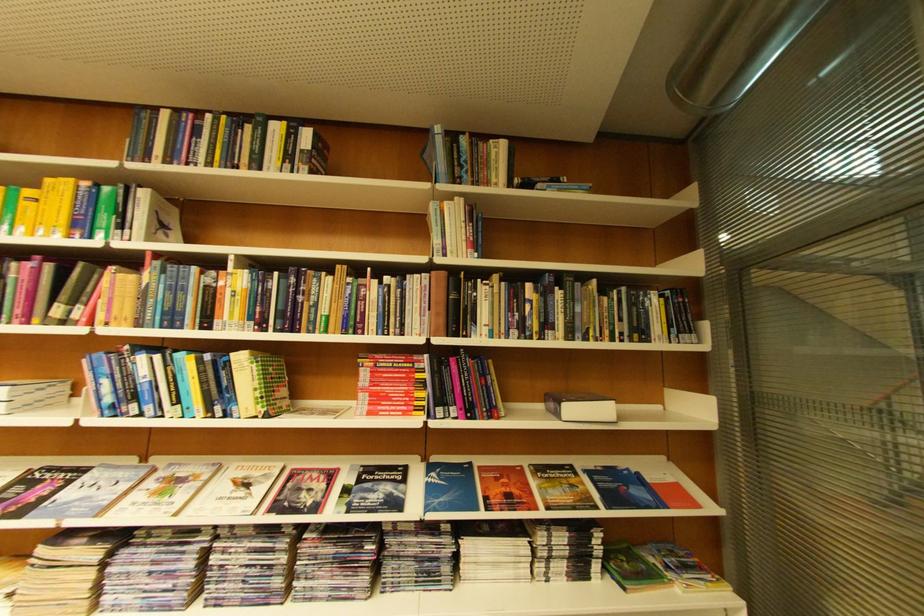
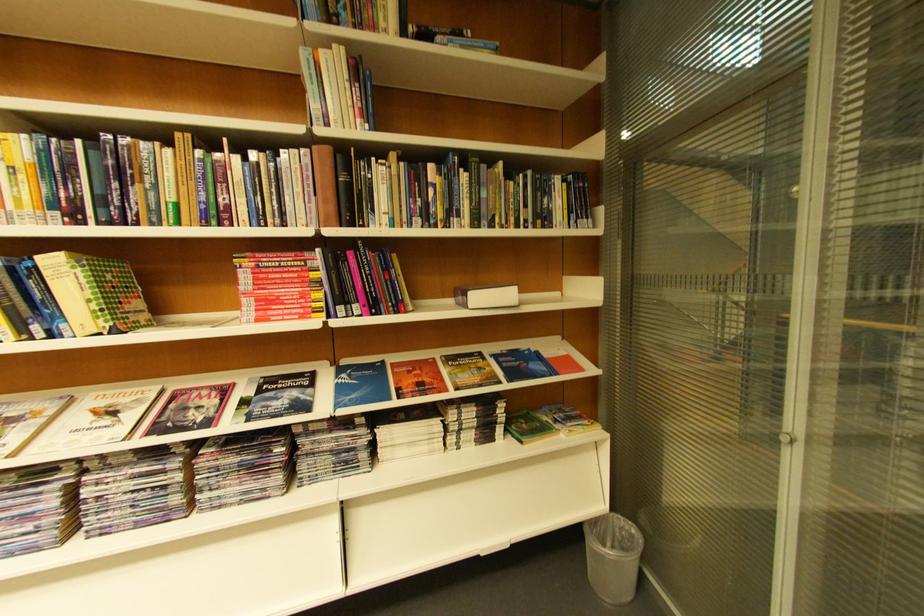
The point at (456, 205) is marked in the first image. Where is the corresponding point in the second image?

(332, 55)